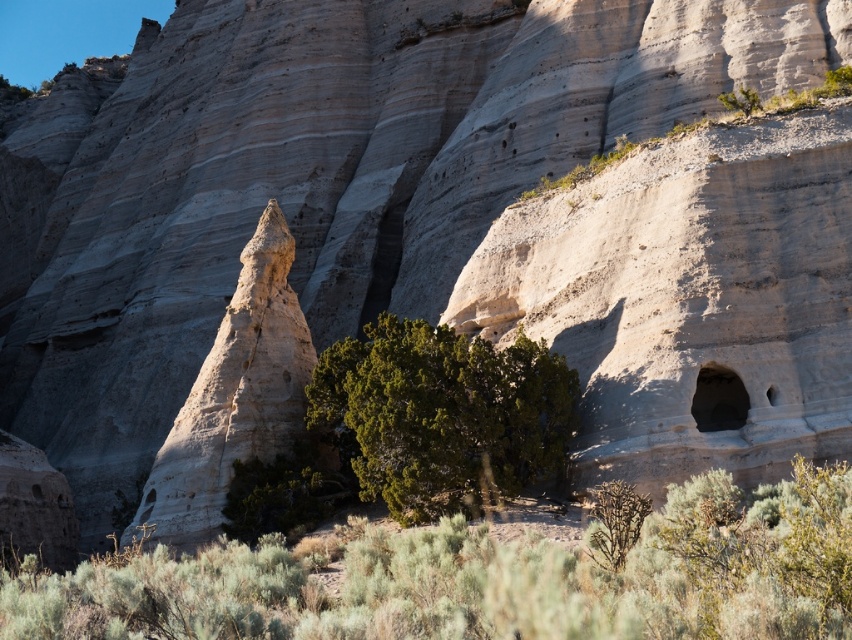
Question: Can you confirm if green shrubbery at center is positioned below green matte/juniper bush at lower center?

Choices:
 (A) yes
 (B) no

Answer: (A)

Question: Among these points, which one is farthest from the camera?

Choices:
 (A) click(x=701, y=397)
 (B) click(x=626, y=541)

Answer: (A)

Question: Which point is farther to the camera?

Choices:
 (A) (622, 516)
 (B) (724, 387)
 (C) (243, 413)
 (D) (613, 579)

Answer: (C)

Question: Which of these objects is positioned farthest from the smooth gray rock at right?

Choices:
 (A) green matte/juniper bush at lower center
 (B) green leafy bush at center
 (C) smooth sandstone spire at center

Answer: (C)

Question: Does green leafy bush at center have a greater width compared to smooth gray rock at right?

Choices:
 (A) yes
 (B) no

Answer: (A)

Question: Does green leafy bush at center have a greater width compared to smooth gray rock at right?

Choices:
 (A) yes
 (B) no

Answer: (A)